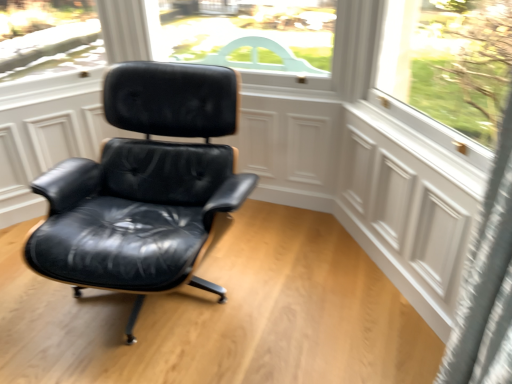
Question: From a real-world perspective, relative to white matte screen door at right, is black leather chair at center vertically above or below?

Choices:
 (A) below
 (B) above

Answer: (B)

Question: Is point (123, 271) positioned closer to the camera than point (360, 127)?

Choices:
 (A) farther
 (B) closer

Answer: (B)

Question: From their relative heights in the image, would you say black leather chair at center is taller or shorter than white matte screen door at right?

Choices:
 (A) tall
 (B) short

Answer: (A)

Question: From the image's perspective, relative to black leather chair at center, is white matte screen door at right above or below?

Choices:
 (A) below
 (B) above

Answer: (A)

Question: From their relative heights in the image, would you say white matte screen door at right is taller or shorter than black leather chair at center?

Choices:
 (A) short
 (B) tall

Answer: (A)

Question: Is white matte screen door at right inside or outside of black leather chair at center?

Choices:
 (A) inside
 (B) outside

Answer: (B)

Question: Is point (423, 168) closer or farther from the camera than point (212, 188)?

Choices:
 (A) closer
 (B) farther

Answer: (A)